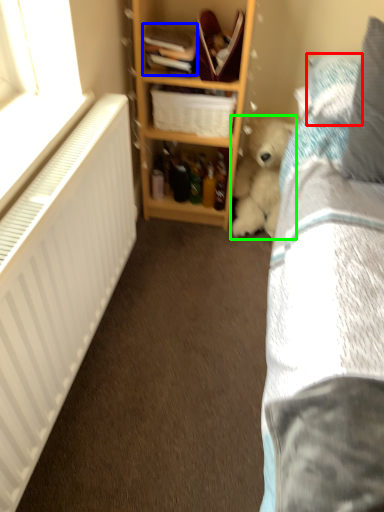
Question: Based on their relative distances, which object is farther from pillow (highlighted by a red box)? Choose from book (highlighted by a blue box) and teddy bear (highlighted by a green box).

Choices:
 (A) book
 (B) teddy bear

Answer: (A)